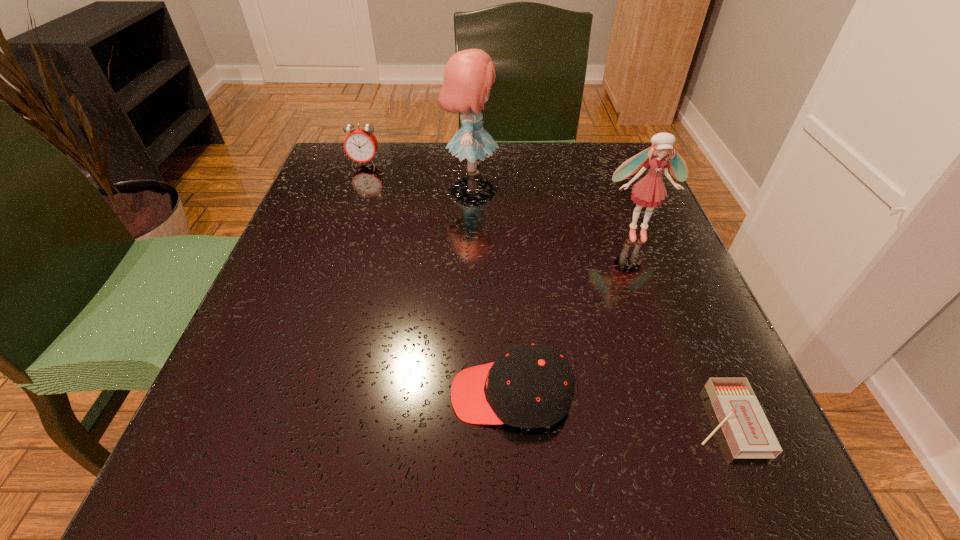
This screenshot has width=960, height=540. I want to click on vacant region located on the front-facing side of the alarm clock, so click(326, 273).

Where is `free space located 0.320m on the front-facing side of the cap`? Image resolution: width=960 pixels, height=540 pixels. free space located 0.320m on the front-facing side of the cap is located at coordinates (220, 394).

At what (x,y) coordinates should I click in order to perform the action: click on vacant region located on the front-facing side of the cap. Please return your answer as a coordinate pair (x, y). Looking at the image, I should click on (343, 394).

Where is `free region located 0.230m on the front-facing side of the cap`? The width and height of the screenshot is (960, 540). free region located 0.230m on the front-facing side of the cap is located at coordinates (285, 394).

Locate an element on the screen. This screenshot has width=960, height=540. blank space located on the striking surface of the matchbox is located at coordinates (594, 420).

Where is `vacant space located on the striking surface of the matchbox`? vacant space located on the striking surface of the matchbox is located at coordinates (655, 420).

At what (x,y) coordinates should I click in order to perform the action: click on blank space located on the striking surface of the matchbox. Please return your answer as a coordinate pair (x, y). The image size is (960, 540). Looking at the image, I should click on (489, 420).

Locate an element on the screen. Image resolution: width=960 pixels, height=540 pixels. doll located in the far edge section of the desktop is located at coordinates (469, 74).

Find the location of a particular element. The height and width of the screenshot is (540, 960). alarm clock located at the far edge is located at coordinates click(x=360, y=145).

The image size is (960, 540). I want to click on object at the near edge, so click(748, 433).